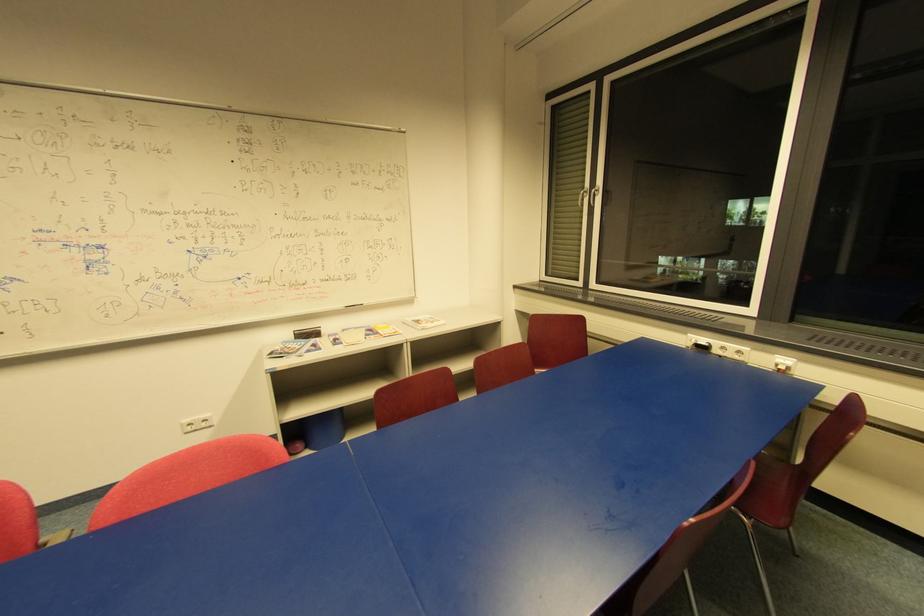
Where would you sit the red chair sitting surface? Please return your answer as a coordinate pair (x, y).

(772, 493)